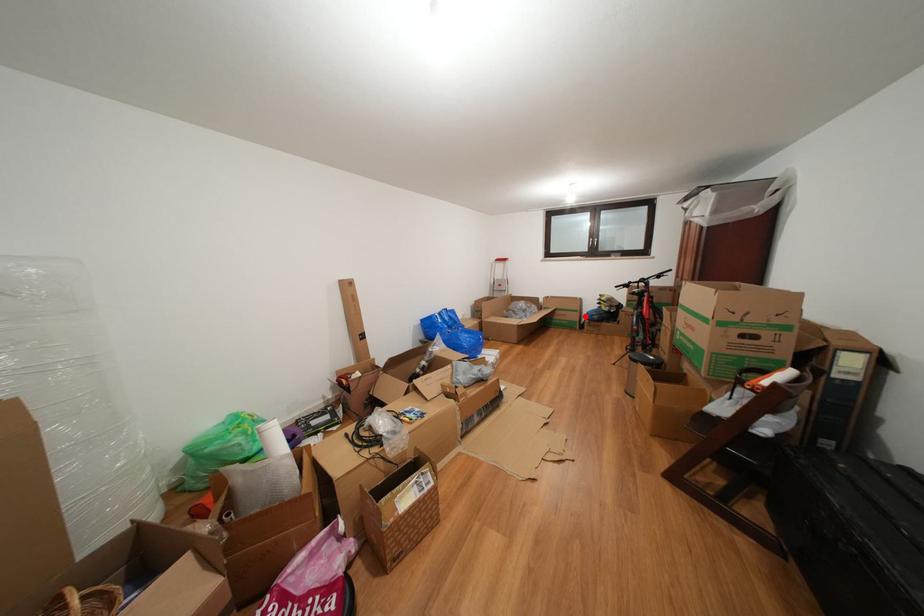
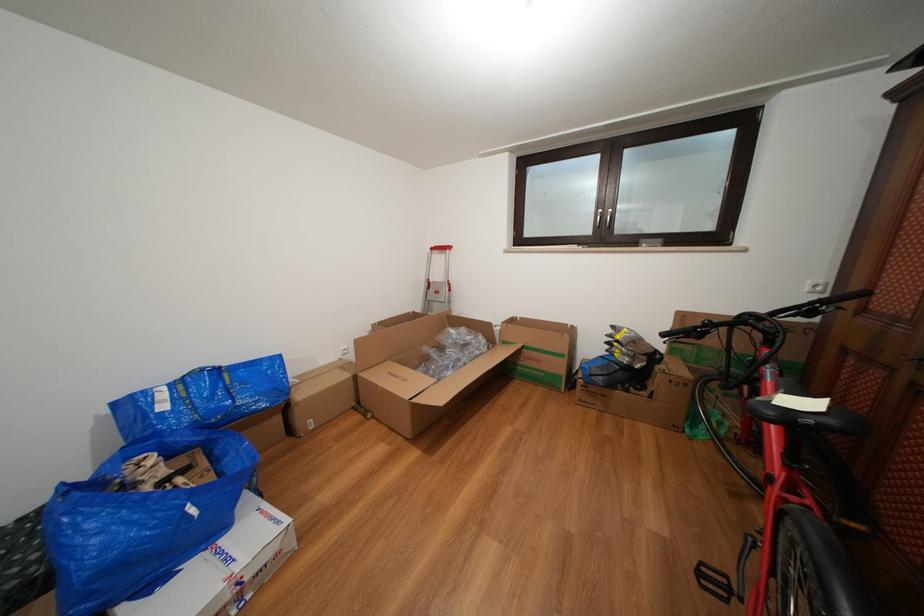
Question: I am providing you with two images of the same scene from different viewpoints. Given a red point in image1, look at the same physical point in image2. Is it:

Choices:
 (A) Closer to the viewpoint
 (B) Farther from the viewpoint

Answer: (A)